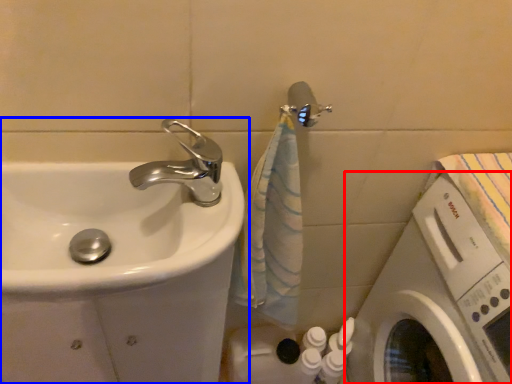
Question: Among these objects, which one is nearest to the camera, washing machine (highlighted by a red box) or sink (highlighted by a blue box)?

Choices:
 (A) washing machine
 (B) sink

Answer: (A)